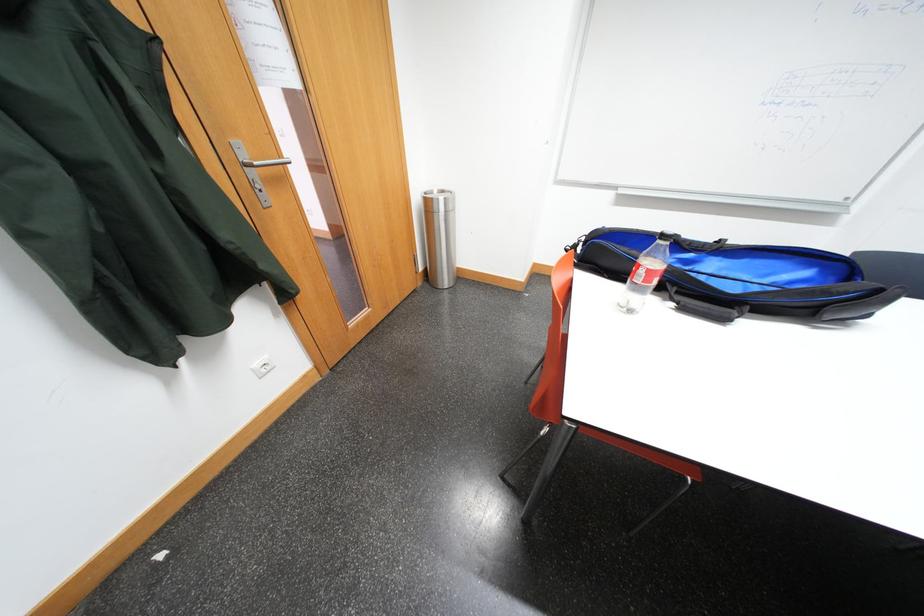
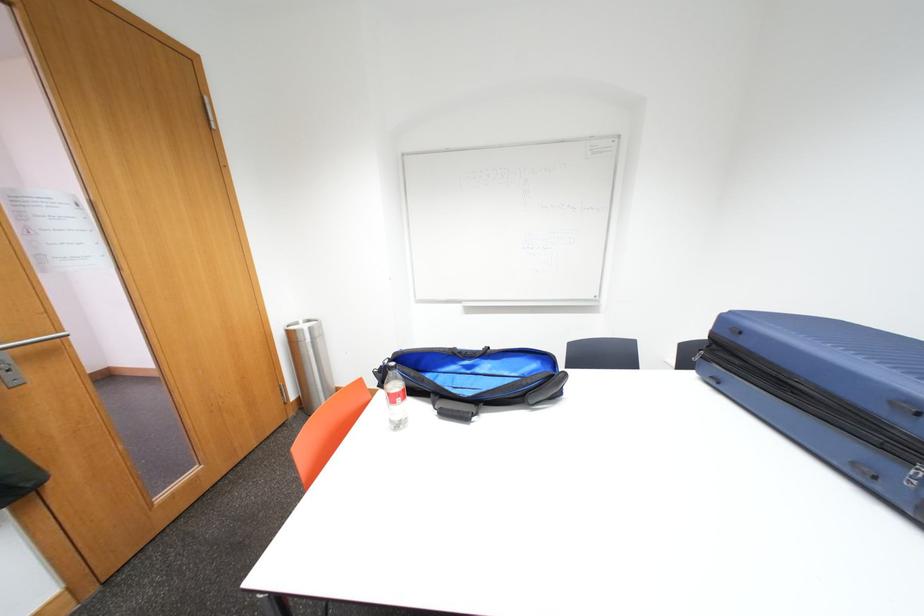
The images are taken continuously from a first-person perspective. In which direction are you moving?

The cameraman walked toward right, backward.